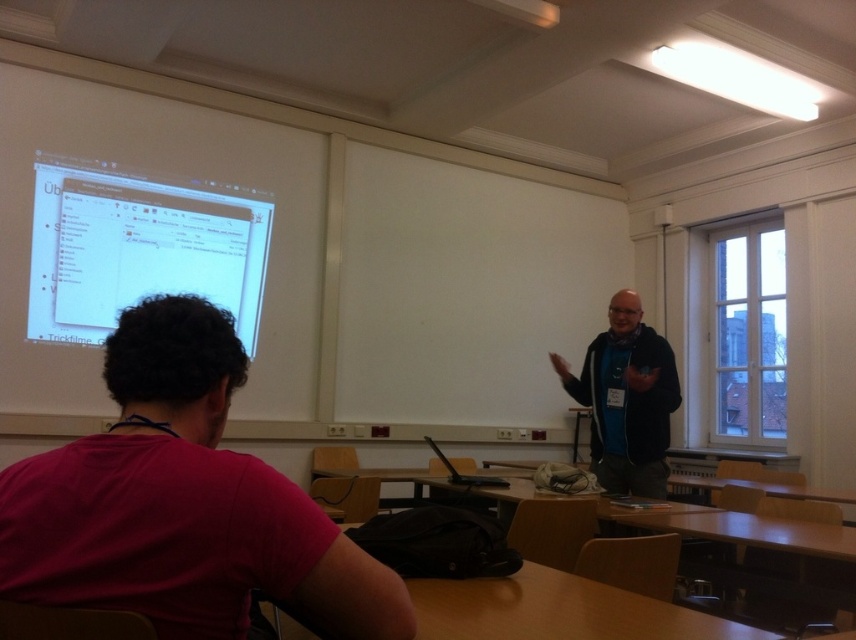
Question: Estimate the real-world distances between objects in this image. Which object is farther from the matte white projector screen at upper left?

Choices:
 (A) dark blue sweater at center
 (B) dark red t-shirt at lower left

Answer: (B)

Question: Is dark red t-shirt at lower left further to camera compared to dark blue sweater at center?

Choices:
 (A) yes
 (B) no

Answer: (B)

Question: In this image, where is matte white projector screen at upper left located relative to dark blue sweater at center?

Choices:
 (A) left
 (B) right

Answer: (A)

Question: Among these points, which one is farthest from the camera?

Choices:
 (A) (189, 198)
 (B) (70, 506)

Answer: (A)

Question: Which object is farther from the camera taking this photo?

Choices:
 (A) dark red t-shirt at lower left
 (B) dark blue sweater at center
 (C) matte white projector screen at upper left

Answer: (C)

Question: From the image, what is the correct spatial relationship of dark red t-shirt at lower left in relation to matte white projector screen at upper left?

Choices:
 (A) left
 (B) right

Answer: (B)